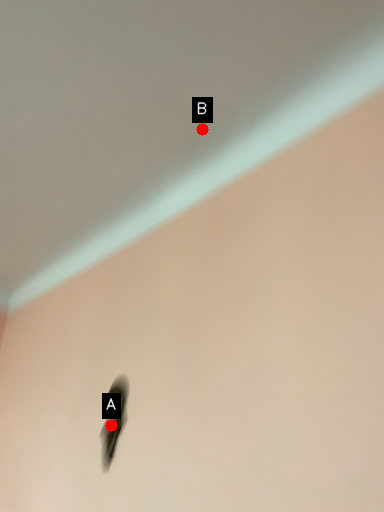
Question: Two points are circled on the image, labeled by A and B beside each circle. Which of the following is the closest to the observer?

Choices:
 (A) A is closer
 (B) B is closer

Answer: (B)